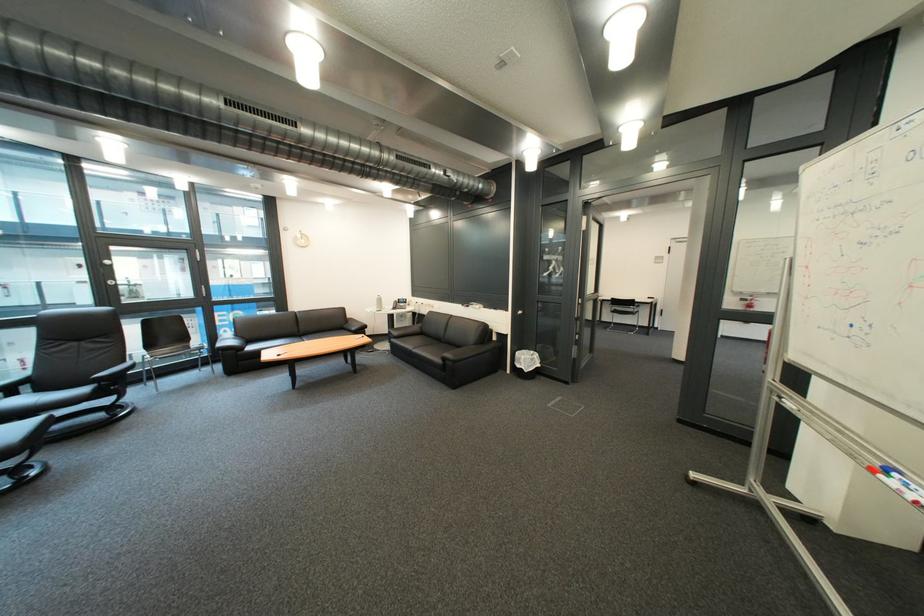
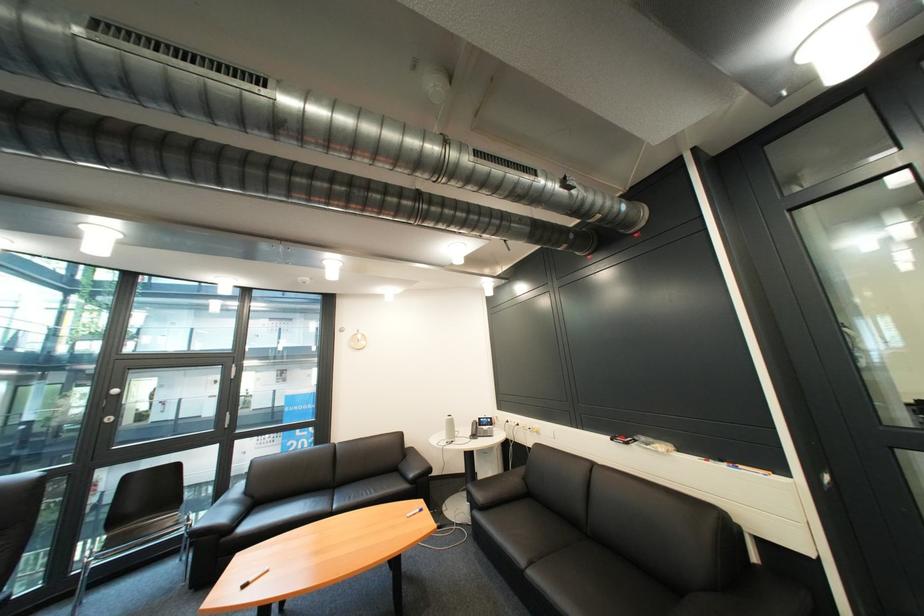
In the second image, find the point that corresponds to the point at 116,274 in the first image.

(118, 408)